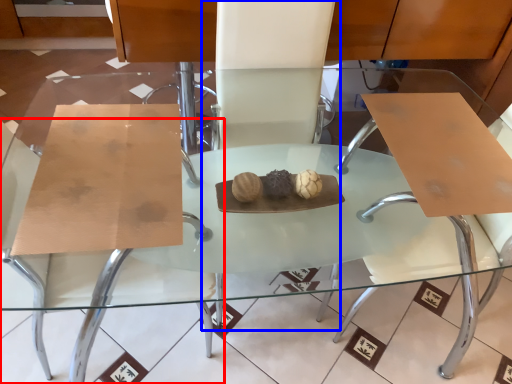
Question: Which of the following is the farthest to the observer, chair (highlighted by a red box) or chair (highlighted by a blue box)?

Choices:
 (A) chair
 (B) chair

Answer: (B)